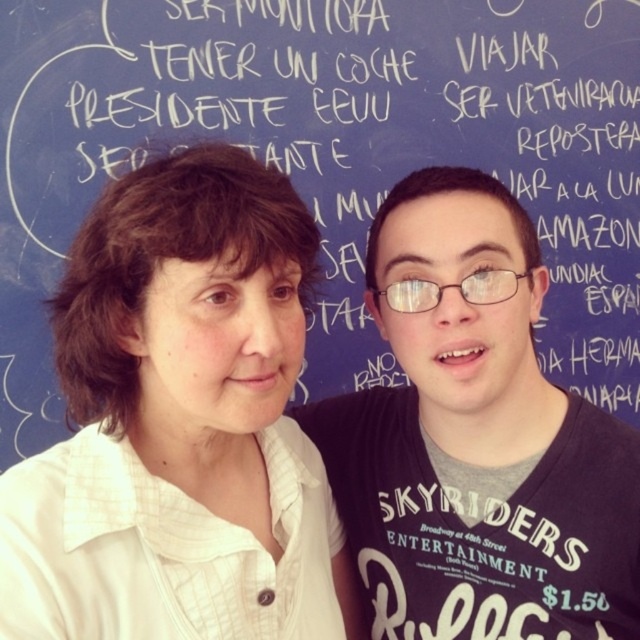
Question: Among these objects, which one is farthest from the camera?

Choices:
 (A) white textured shirt at upper left
 (B) dark gray cotton shirt at center

Answer: (B)

Question: Which point is farther to the camera?

Choices:
 (A) (355, 556)
 (B) (225, 486)

Answer: (A)

Question: Is white textured shirt at upper left smaller than dark gray cotton shirt at center?

Choices:
 (A) yes
 (B) no

Answer: (B)

Question: Does white textured shirt at upper left lie behind dark gray cotton shirt at center?

Choices:
 (A) yes
 (B) no

Answer: (B)

Question: Is the position of white textured shirt at upper left less distant than that of dark gray cotton shirt at center?

Choices:
 (A) no
 (B) yes

Answer: (B)